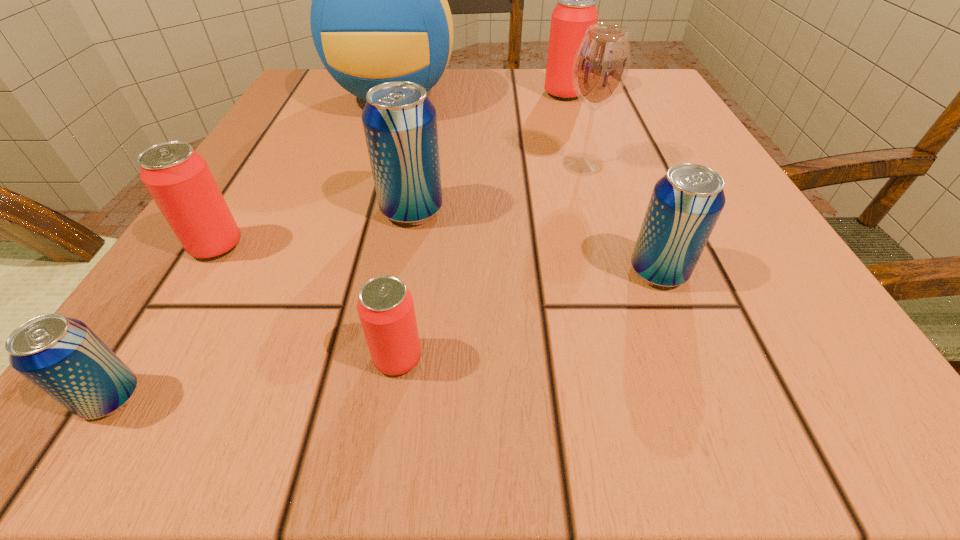
Where is `vacant point located between the second biggest blue beer can and the blue volleyball`? vacant point located between the second biggest blue beer can and the blue volleyball is located at coordinates (526, 185).

Image resolution: width=960 pixels, height=540 pixels. Identify the location of vacant point located between the smallest red beer can and the second smallest red beer can. (307, 302).

At what (x,y) coordinates should I click in order to perform the action: click on empty location between the rightmost red beer can and the third farthest object. Please return your answer as a coordinate pair (x, y). The height and width of the screenshot is (540, 960). Looking at the image, I should click on 573,129.

Where is `unoccupied area between the second red beer can from left to right and the tallest object`? This screenshot has width=960, height=540. unoccupied area between the second red beer can from left to right and the tallest object is located at coordinates point(396,228).

Where is `vacant point located between the smallest red beer can and the farthest red beer can`? The image size is (960, 540). vacant point located between the smallest red beer can and the farthest red beer can is located at coordinates (481, 226).

At what (x,y) coordinates should I click in order to perform the action: click on object that is the sixth closest to the second blue beer can from left to right. Please return your answer as a coordinate pair (x, y). This screenshot has height=540, width=960. Looking at the image, I should click on (62, 356).

This screenshot has height=540, width=960. Find the location of `object that is the seventh closest to the rightmost blue beer can`. object that is the seventh closest to the rightmost blue beer can is located at coordinates (62, 356).

This screenshot has height=540, width=960. Identify the location of the fifth closest beer can to the wineglass. (178, 179).

I want to click on beer can that is the fifth closest to the smallest red beer can, so click(576, 10).

Select which red beer can appears as the second closest to the leftmost blue beer can. Please provide its 2D coordinates. Your answer should be formatted as a tuple, i.e. [(x, y)], where the tuple contains the x and y coordinates of a point satisfying the conditions above.

[(385, 307)]